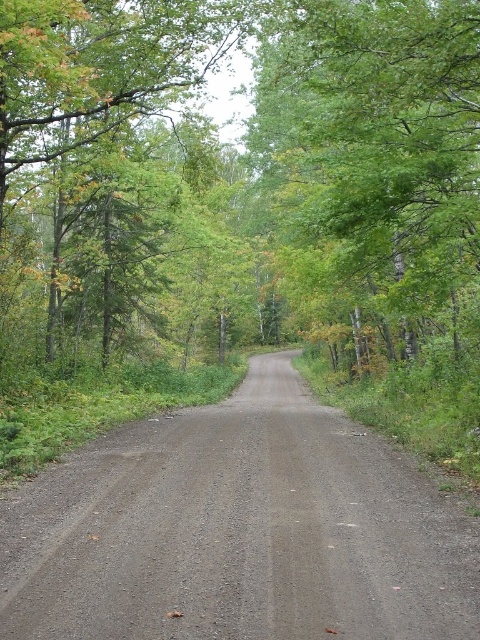
Question: Does green leafy tree at center appear over gray gravel road at center?

Choices:
 (A) no
 (B) yes

Answer: (B)

Question: Which point is farther to the camera?

Choices:
 (A) green leafy tree at center
 (B) gray gravel road at center

Answer: (A)

Question: Is green leafy tree at center below gray gravel road at center?

Choices:
 (A) yes
 (B) no

Answer: (B)

Question: Which point is farther to the camera?

Choices:
 (A) (49, 285)
 (B) (187, 476)

Answer: (A)

Question: Does green leafy tree at center appear on the left side of gray gravel road at center?

Choices:
 (A) no
 (B) yes

Answer: (B)